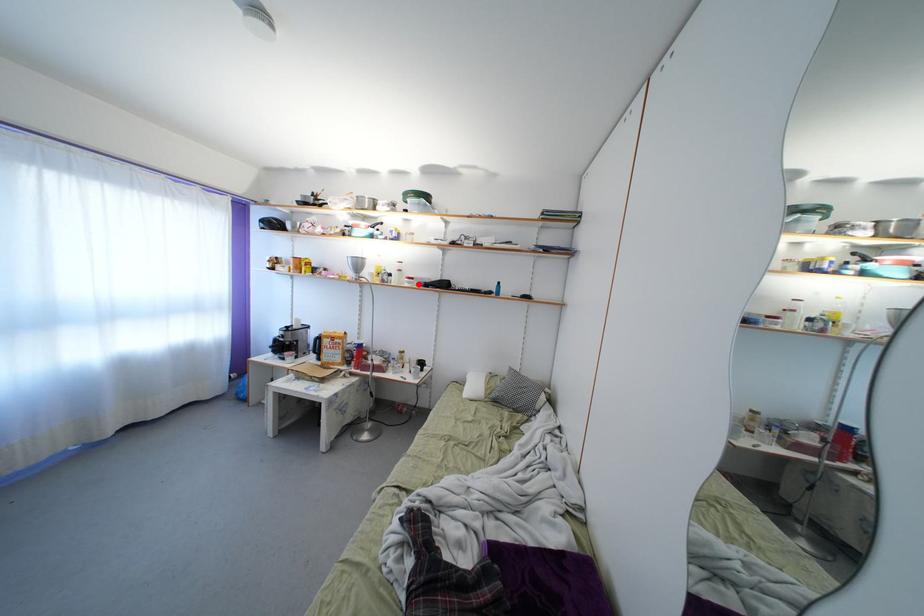
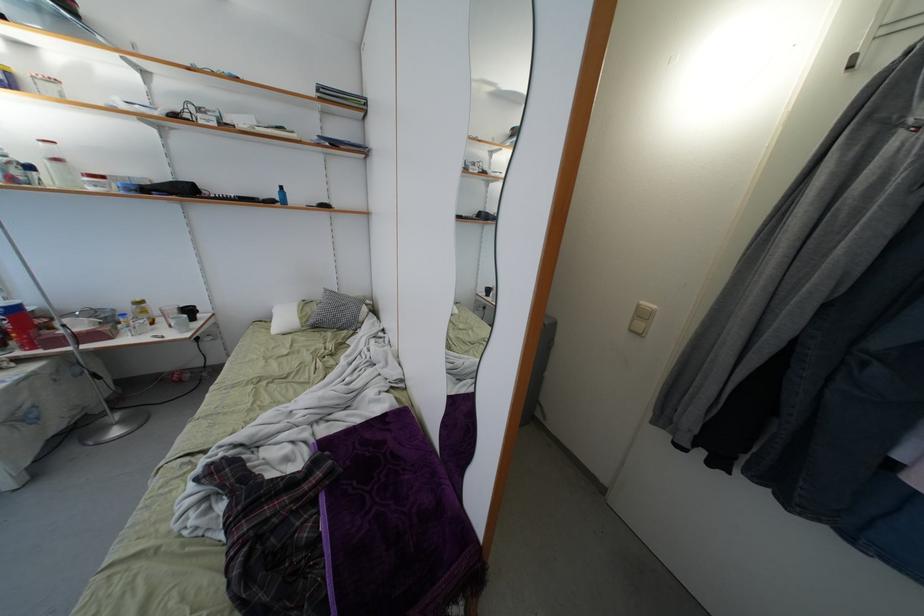
Find the pixel in the second image that matches the highlighted location in the first image.

(110, 184)